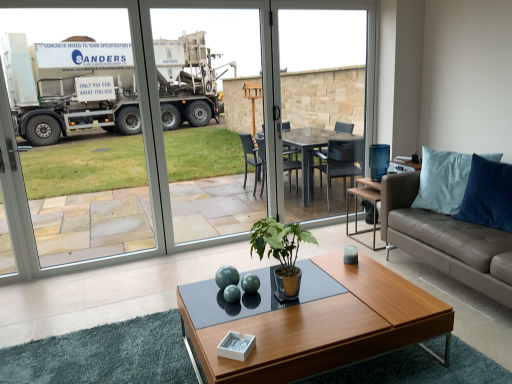
Identify the location of free point above transparent glass table at center (from a real-world perspective). (327, 1).